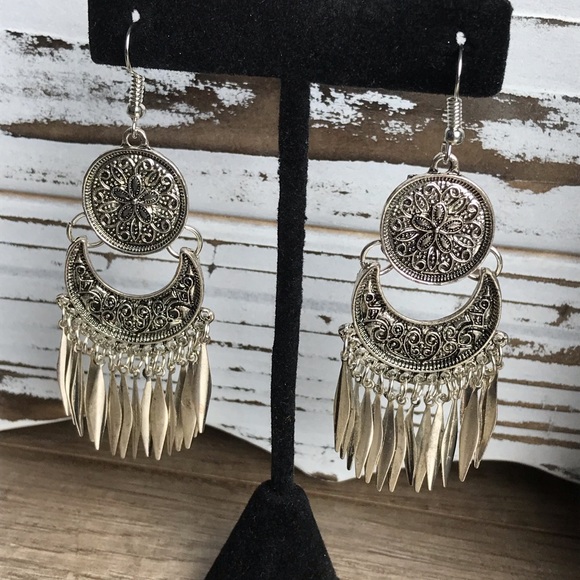
Identify the location of bare wood. The width and height of the screenshot is (580, 580). (252, 137).